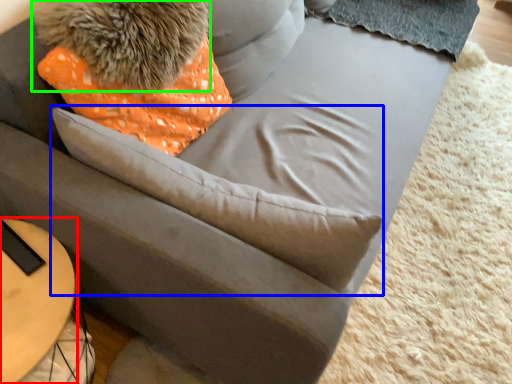
Question: Considering the real-world distances, which object is farthest from table (highlighted by a red box)? throw pillow (highlighted by a blue box) or animal (highlighted by a green box)?

Choices:
 (A) throw pillow
 (B) animal

Answer: (B)